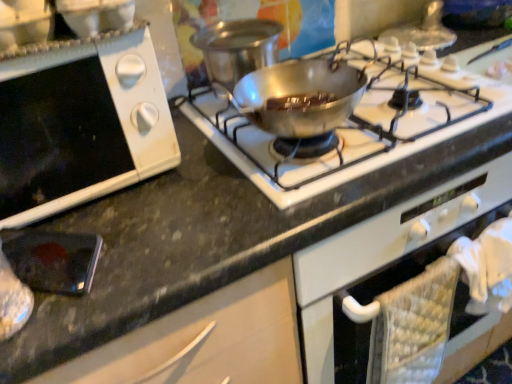
Question: From the image's perspective, is metallic silver pan at center located above or below white matte oven at lower left?

Choices:
 (A) below
 (B) above

Answer: (B)

Question: Is point (241, 21) closer or farther from the camera than point (82, 104)?

Choices:
 (A) farther
 (B) closer

Answer: (A)

Question: Which of these objects is positioned closest to the shiny silver pan at center?

Choices:
 (A) metallic silver pan at center
 (B) metallic silver phone at lower left
 (C) white matte oven at lower left

Answer: (A)

Question: Considering the real-world distances, which object is farthest from the metallic silver phone at lower left?

Choices:
 (A) white matte oven at lower left
 (B) metallic silver pan at center
 (C) shiny silver pan at center

Answer: (C)